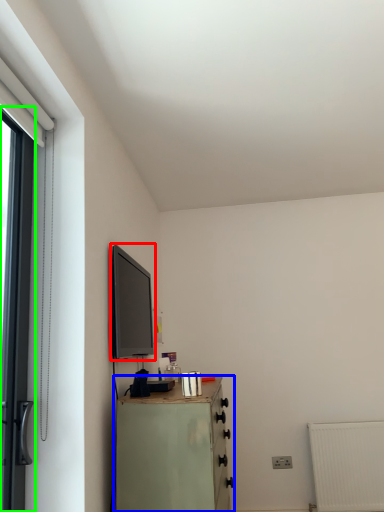
Question: Which is nearer to the window screen (highlighted by a red box)? chest of drawers (highlighted by a blue box) or door (highlighted by a green box).

Choices:
 (A) chest of drawers
 (B) door

Answer: (A)